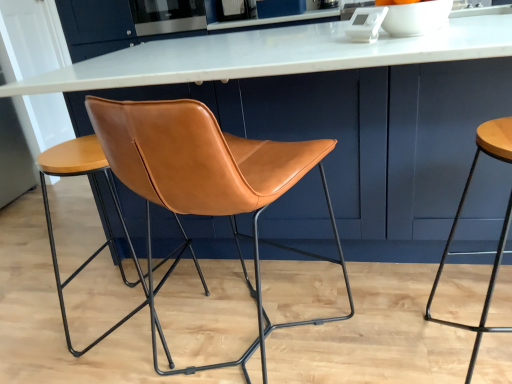
Question: Considering their positions, is white marble table at center located in front of or behind satin stainless steel oven at upper center?

Choices:
 (A) behind
 (B) front

Answer: (B)

Question: Is white marble table at center taller or shorter than satin stainless steel oven at upper center?

Choices:
 (A) tall
 (B) short

Answer: (A)

Question: Based on their relative distances, which object is nearer to the white marble table at center?

Choices:
 (A) satin stainless steel oven at upper center
 (B) saddle brown leather chair at center
 (C) leather at center, the 1th stool from the left
 (D) matte brown stool at right, marked as the second stool in a left-to-right arrangement

Answer: (B)

Question: Which object is positioned closest to the leather at center, acting as the 2th stool starting from the right?

Choices:
 (A) matte brown stool at right, marked as the second stool in a left-to-right arrangement
 (B) white marble table at center
 (C) satin stainless steel oven at upper center
 (D) saddle brown leather chair at center

Answer: (D)